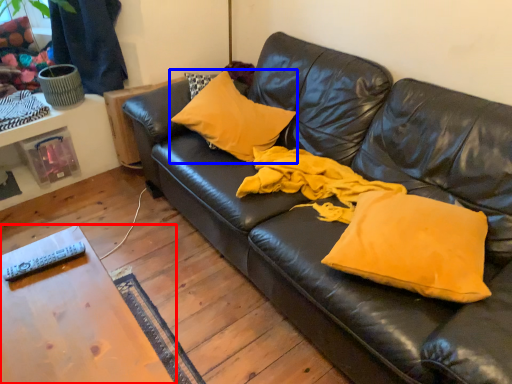
Question: Which object is closer to the camera taking this photo, table (highlighted by a red box) or pillow (highlighted by a blue box)?

Choices:
 (A) table
 (B) pillow

Answer: (A)